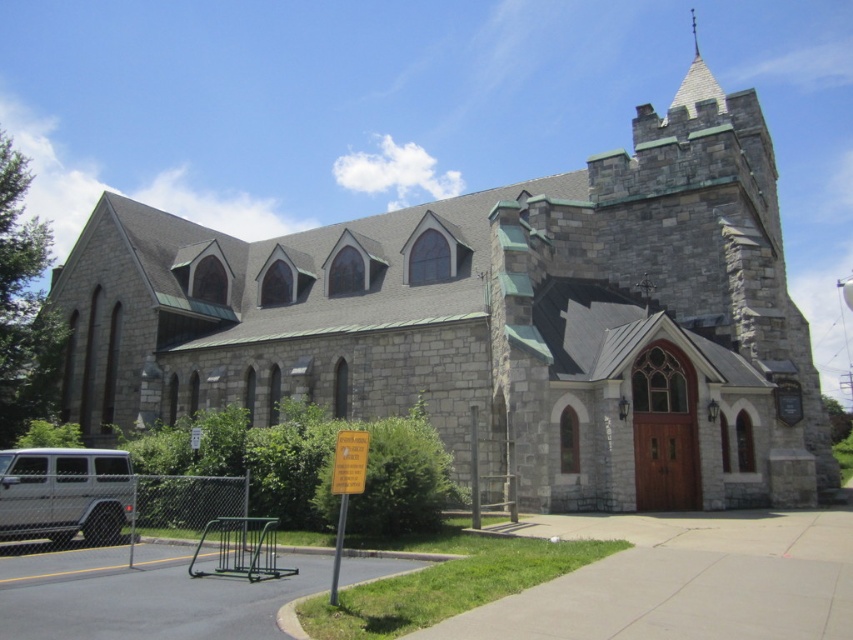
Is point (50, 476) less distant than point (695, 77)?

That is True.

Does silver metallic van at lower left come in front of gray stone spire at upper center?

Yes, silver metallic van at lower left is closer to the viewer.

The image size is (853, 640). I want to click on silver metallic van at lower left, so click(x=64, y=493).